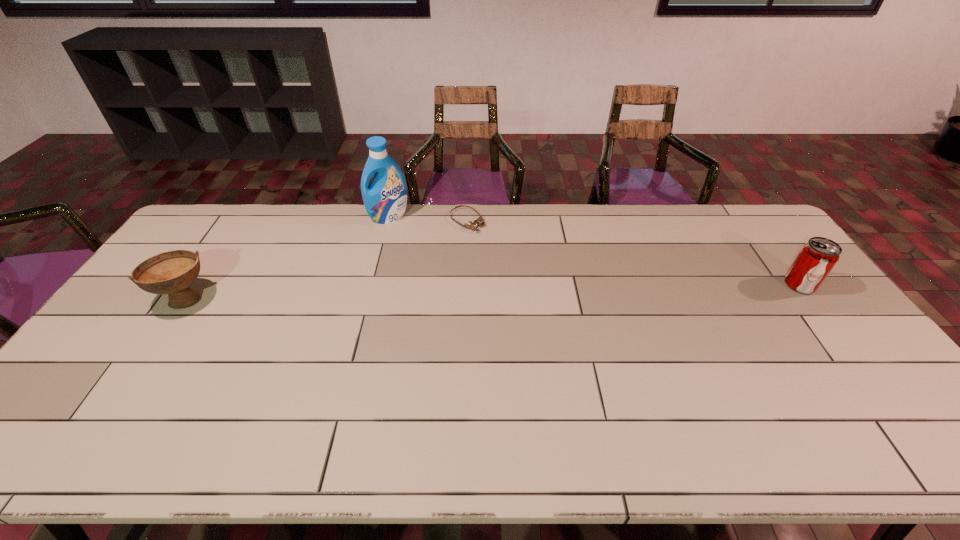
Identify the location of vacant space located on the front lenses and sides of the goggles. The image size is (960, 540). (528, 273).

You are a GUI agent. You are given a task and a screenshot of the screen. Output one action in this format:
    pyautogui.click(x=<x>, y=<y>)
    Task: Click on the free spot located on the front-facing side of the tallest object
    
    Given the screenshot: What is the action you would take?
    pyautogui.click(x=404, y=239)

Identify the location of free space located 0.330m on the front-facing side of the tallest object. (427, 281).

Image resolution: width=960 pixels, height=540 pixels. What are the coordinates of `vacant region located on the front-facing side of the tallest object` in the screenshot? It's located at (406, 242).

The height and width of the screenshot is (540, 960). I want to click on goggles present at the far edge, so click(471, 225).

The image size is (960, 540). I want to click on detergent situated at the far edge, so click(385, 199).

You are a GUI agent. You are given a task and a screenshot of the screen. Output one action in this format:
    pyautogui.click(x=<x>, y=<y>)
    Task: Click on the object that is at the left edge
    The image size is (960, 540).
    Given the screenshot: What is the action you would take?
    [172, 273]

Find the location of `object positioned at the right edge`. object positioned at the right edge is located at coordinates (817, 257).

You are a GUI agent. You are given a task and a screenshot of the screen. Output one action in this format:
    pyautogui.click(x=<x>, y=<y>)
    Task: Click on the free region at the far edge of the desktop
    Image resolution: width=960 pixels, height=540 pixels.
    Given the screenshot: What is the action you would take?
    pyautogui.click(x=703, y=244)

Find the location of a particular element. free space at the near edge of the desktop is located at coordinates (495, 392).